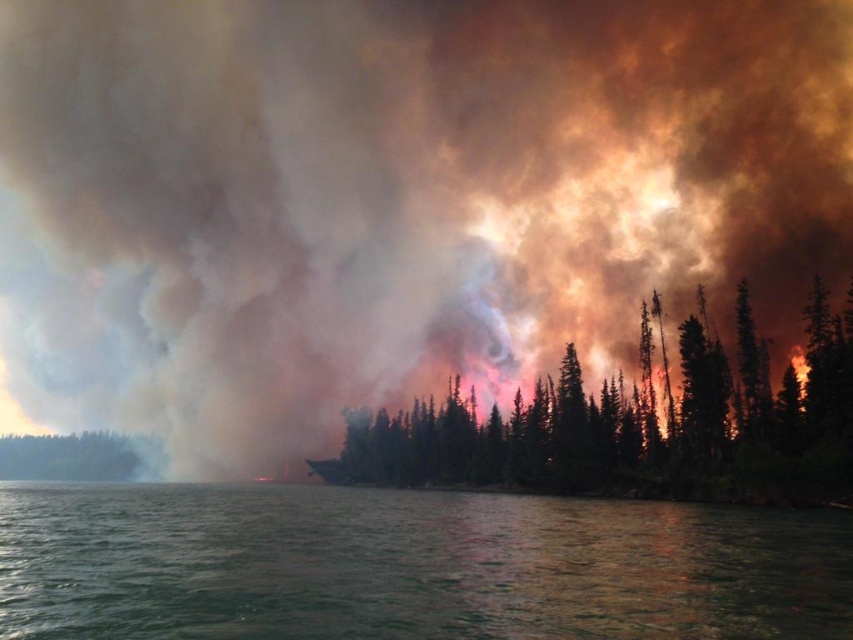
Question: Which of the following is the closest to the observer?

Choices:
 (A) green matte tree at left
 (B) green leafy trees at center

Answer: (B)

Question: Which object is the closest to the green water at lower center?

Choices:
 (A) green leafy trees at center
 (B) green matte tree at left

Answer: (A)

Question: Is green water at lower center positioned at the back of green matte tree at left?

Choices:
 (A) yes
 (B) no

Answer: (B)

Question: Which object is positioned closest to the green water at lower center?

Choices:
 (A) green leafy trees at center
 (B) green matte tree at left

Answer: (A)

Question: Where is green water at lower center located in relation to green matte tree at left in the image?

Choices:
 (A) above
 (B) below

Answer: (A)

Question: From the image, what is the correct spatial relationship of green water at lower center in relation to green leafy trees at center?

Choices:
 (A) above
 (B) below

Answer: (A)